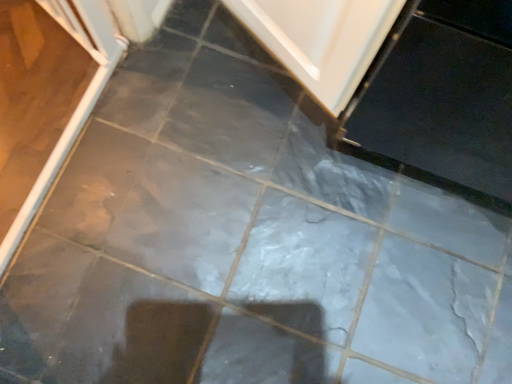
Question: Considering their positions, is white glossy door at upper center located in front of or behind white glossy screen door at left?

Choices:
 (A) front
 (B) behind

Answer: (B)

Question: From the image's perspective, is white glossy door at upper center located above or below white glossy screen door at left?

Choices:
 (A) below
 (B) above

Answer: (B)

Question: Is point (278, 28) positioned closer to the camera than point (104, 81)?

Choices:
 (A) farther
 (B) closer

Answer: (B)

Question: Would you say white glossy screen door at left is to the left or to the right of white glossy door at upper center in the picture?

Choices:
 (A) left
 (B) right

Answer: (A)

Question: Considering the positions of white glossy screen door at left and white glossy door at upper center in the image, is white glossy screen door at left bigger or smaller than white glossy door at upper center?

Choices:
 (A) big
 (B) small

Answer: (B)

Question: From the image's perspective, is white glossy screen door at left above or below white glossy door at upper center?

Choices:
 (A) above
 (B) below

Answer: (B)

Question: Is white glossy screen door at left spatially inside white glossy door at upper center, or outside of it?

Choices:
 (A) inside
 (B) outside

Answer: (B)